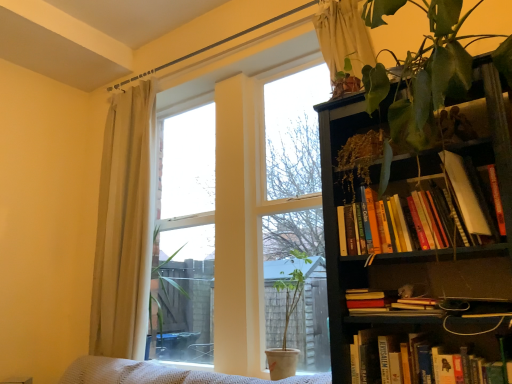
Question: From a real-world perspective, is transparent glass window at center beneath white sheer curtain at upper center, which is the 1th curtain from right to left?

Choices:
 (A) yes
 (B) no

Answer: (A)

Question: Does transparent glass window at center appear on the left side of white sheer curtain at upper center, the 2th curtain when ordered from back to front?

Choices:
 (A) yes
 (B) no

Answer: (A)

Question: Can you confirm if transparent glass window at center is bigger than white sheer curtain at upper center, which ranks as the first curtain in front-to-back order?

Choices:
 (A) no
 (B) yes

Answer: (B)

Question: Does transparent glass window at center come in front of white sheer curtain at upper center, which ranks as the first curtain in front-to-back order?

Choices:
 (A) no
 (B) yes

Answer: (B)

Question: Does transparent glass window at center touch white sheer curtain at upper center, the second curtain from the left?

Choices:
 (A) yes
 (B) no

Answer: (B)

Question: From a real-world perspective, is hardcover books at upper right, arranged as the 1th book when viewed from the top, physically located above or below matte white pot at center?

Choices:
 (A) above
 (B) below

Answer: (A)

Question: Considering the positions of hardcover books at upper right, arranged as the 1th book when viewed from the top, and matte white pot at center in the image, is hardcover books at upper right, arranged as the 1th book when viewed from the top, taller or shorter than matte white pot at center?

Choices:
 (A) tall
 (B) short

Answer: (B)

Question: Considering the relative positions of hardcover books at upper right, arranged as the 1th book when viewed from the top, and matte white pot at center in the image provided, is hardcover books at upper right, arranged as the 1th book when viewed from the top, to the left or to the right of matte white pot at center?

Choices:
 (A) right
 (B) left

Answer: (A)

Question: Considering their positions, is hardcover books at upper right, arranged as the 1th book when viewed from the top, located in front of or behind matte white pot at center?

Choices:
 (A) front
 (B) behind

Answer: (A)

Question: Considering the relative positions of beige fabric curtain at left, the first curtain from the left, and transparent glass window at center in the image provided, is beige fabric curtain at left, the first curtain from the left, to the left or to the right of transparent glass window at center?

Choices:
 (A) right
 (B) left

Answer: (B)

Question: Which is correct: beige fabric curtain at left, the second curtain in the front-to-back sequence, is inside transparent glass window at center, or outside of it?

Choices:
 (A) outside
 (B) inside

Answer: (A)

Question: Is beige fabric curtain at left, the first curtain from the left, in front of or behind transparent glass window at center in the image?

Choices:
 (A) behind
 (B) front

Answer: (A)

Question: Considering the positions of beige fabric curtain at left, the second curtain in the front-to-back sequence, and transparent glass window at center in the image, is beige fabric curtain at left, the second curtain in the front-to-back sequence, taller or shorter than transparent glass window at center?

Choices:
 (A) short
 (B) tall

Answer: (A)

Question: From their relative heights in the image, would you say hardcover book at lower right, which is the 2th book from top to bottom, is taller or shorter than white sheer curtain at upper center, which is the 1th curtain from right to left?

Choices:
 (A) tall
 (B) short

Answer: (B)

Question: From the image's perspective, is hardcover book at lower right, which is the 2th book from top to bottom, above or below white sheer curtain at upper center, the second curtain from the left?

Choices:
 (A) below
 (B) above

Answer: (A)